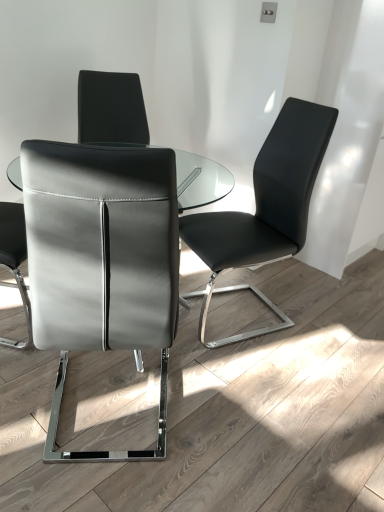
Identify the location of black leather chair at center, placed as the first chair when sorted from right to left. (265, 208).

How much space does black leather chair at center, placed as the first chair when sorted from right to left, occupy horizontally?

The width of black leather chair at center, placed as the first chair when sorted from right to left, is 22.63 inches.

The image size is (384, 512). What do you see at coordinates (265, 208) in the screenshot?
I see `black leather chair at center, placed as the first chair when sorted from right to left` at bounding box center [265, 208].

Image resolution: width=384 pixels, height=512 pixels. What do you see at coordinates (101, 260) in the screenshot?
I see `matte black chair at left, positioned as the 2th chair in right-to-left order` at bounding box center [101, 260].

Locate an element on the screen. This screenshot has width=384, height=512. matte black chair at left, the 1th chair from the left is located at coordinates (101, 260).

Where is `black leather chair at center, placed as the first chair when sorted from right to left`? This screenshot has width=384, height=512. black leather chair at center, placed as the first chair when sorted from right to left is located at coordinates (265, 208).

Which is more to the right, black leather chair at center, the second chair positioned from the left, or matte black chair at left, positioned as the 2th chair in right-to-left order?

black leather chair at center, the second chair positioned from the left.

Is black leather chair at center, the second chair positioned from the left, positioned in front of matte black chair at left, positioned as the 2th chair in right-to-left order?

No, it is not.

Which is in front, point (209, 240) or point (44, 450)?

The point (44, 450) is in front.

From the image's perspective, is black leather chair at center, the second chair positioned from the left, positioned above or below matte black chair at left, positioned as the 2th chair in right-to-left order?

From the image's perspective, black leather chair at center, the second chair positioned from the left, appears above matte black chair at left, positioned as the 2th chair in right-to-left order.

From a real-world perspective, relative to matte black chair at left, the 1th chair from the left, is black leather chair at center, placed as the first chair when sorted from right to left, vertically above or below?

From a real-world perspective, black leather chair at center, placed as the first chair when sorted from right to left, is physically below matte black chair at left, the 1th chair from the left.

Between black leather chair at center, placed as the first chair when sorted from right to left, and matte black chair at left, the 1th chair from the left, which one has larger width?

matte black chair at left, the 1th chair from the left.

Is black leather chair at center, the second chair positioned from the left, taller or shorter than matte black chair at left, the 1th chair from the left?

Considering their sizes, black leather chair at center, the second chair positioned from the left, has more height than matte black chair at left, the 1th chair from the left.

Looking at the image, does black leather chair at center, placed as the first chair when sorted from right to left, seem bigger or smaller compared to matte black chair at left, positioned as the 2th chair in right-to-left order?

black leather chair at center, placed as the first chair when sorted from right to left, is bigger than matte black chair at left, positioned as the 2th chair in right-to-left order.

Would you say black leather chair at center, the second chair positioned from the left, is outside matte black chair at left, positioned as the 2th chair in right-to-left order?

Yes.

Is black leather chair at center, the second chair positioned from the left, with matte black chair at left, positioned as the 2th chair in right-to-left order?

They are not placed beside each other.

Is black leather chair at center, placed as the first chair when sorted from right to left, looking in the opposite direction of matte black chair at left, positioned as the 2th chair in right-to-left order?

No, matte black chair at left, positioned as the 2th chair in right-to-left order, is not at the back of black leather chair at center, placed as the first chair when sorted from right to left.

Measure the distance between black leather chair at center, the second chair positioned from the left, and matte black chair at left, positioned as the 2th chair in right-to-left order.

A distance of 75.75 centimeters exists between black leather chair at center, the second chair positioned from the left, and matte black chair at left, positioned as the 2th chair in right-to-left order.

This screenshot has width=384, height=512. I want to click on chair on the right side of matte black chair at left, positioned as the 2th chair in right-to-left order, so click(x=265, y=208).

Which is more to the right, matte black chair at left, the 1th chair from the left, or black leather chair at center, placed as the first chair when sorted from right to left?

Positioned to the right is black leather chair at center, placed as the first chair when sorted from right to left.

Is matte black chair at left, positioned as the 2th chair in right-to-left order, in front of or behind black leather chair at center, placed as the first chair when sorted from right to left, in the image?

Visually, matte black chair at left, positioned as the 2th chair in right-to-left order, is located in front of black leather chair at center, placed as the first chair when sorted from right to left.

Which is less distant, (103, 347) or (317, 173)?

Clearly, point (103, 347) is closer to the camera than point (317, 173).

From the image's perspective, is matte black chair at left, positioned as the 2th chair in right-to-left order, located above or below black leather chair at center, placed as the first chair when sorted from right to left?

matte black chair at left, positioned as the 2th chair in right-to-left order, is below black leather chair at center, placed as the first chair when sorted from right to left.

From a real-world perspective, is matte black chair at left, positioned as the 2th chair in right-to-left order, over black leather chair at center, the second chair positioned from the left?

Yes, from a real-world perspective, matte black chair at left, positioned as the 2th chair in right-to-left order, is on top of black leather chair at center, the second chair positioned from the left.

Between matte black chair at left, the 1th chair from the left, and black leather chair at center, placed as the first chair when sorted from right to left, which one has larger width?

Wider between the two is matte black chair at left, the 1th chair from the left.

Can you confirm if matte black chair at left, the 1th chair from the left, is taller than black leather chair at center, placed as the first chair when sorted from right to left?

No.

In terms of size, does matte black chair at left, the 1th chair from the left, appear bigger or smaller than black leather chair at center, the second chair positioned from the left?

Considering their sizes, matte black chair at left, the 1th chair from the left, takes up less space than black leather chair at center, the second chair positioned from the left.

Would you say matte black chair at left, the 1th chair from the left, is outside black leather chair at center, the second chair positioned from the left?

That's correct, matte black chair at left, the 1th chair from the left, is outside of black leather chair at center, the second chair positioned from the left.

Is matte black chair at left, the 1th chair from the left, not near black leather chair at center, the second chair positioned from the left?

That's not correct — matte black chair at left, the 1th chair from the left, is a little close to black leather chair at center, the second chair positioned from the left.

Is matte black chair at left, the 1th chair from the left, facing away from black leather chair at center, the second chair positioned from the left?

matte black chair at left, the 1th chair from the left, is not turned away from black leather chair at center, the second chair positioned from the left.

How different are the orientations of matte black chair at left, the 1th chair from the left, and black leather chair at center, placed as the first chair when sorted from right to left, in degrees?

The facing directions of matte black chair at left, the 1th chair from the left, and black leather chair at center, placed as the first chair when sorted from right to left, are 113 degrees apart.

The height and width of the screenshot is (512, 384). Identify the location of chair positioned vertically above the black leather chair at center, placed as the first chair when sorted from right to left (from a real-world perspective). (101, 260).

At what (x,y) coordinates should I click in order to perform the action: click on chair below the matte black chair at left, the 1th chair from the left (from a real-world perspective). Please return your answer as a coordinate pair (x, y). Looking at the image, I should click on (265, 208).

Where is `chair located in front of the black leather chair at center, placed as the first chair when sorted from right to left`? This screenshot has width=384, height=512. chair located in front of the black leather chair at center, placed as the first chair when sorted from right to left is located at coordinates point(101,260).